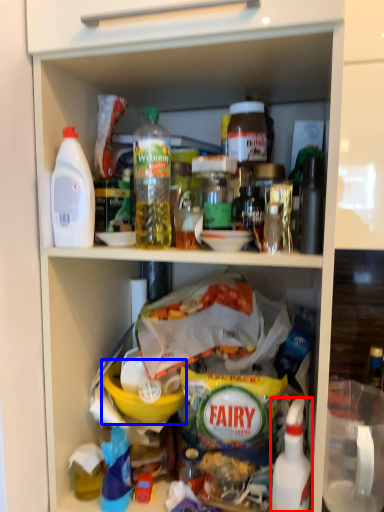
Question: Which point is further to the camera, bottle (highlighted by a red box) or bowl (highlighted by a blue box)?

Choices:
 (A) bottle
 (B) bowl

Answer: (B)